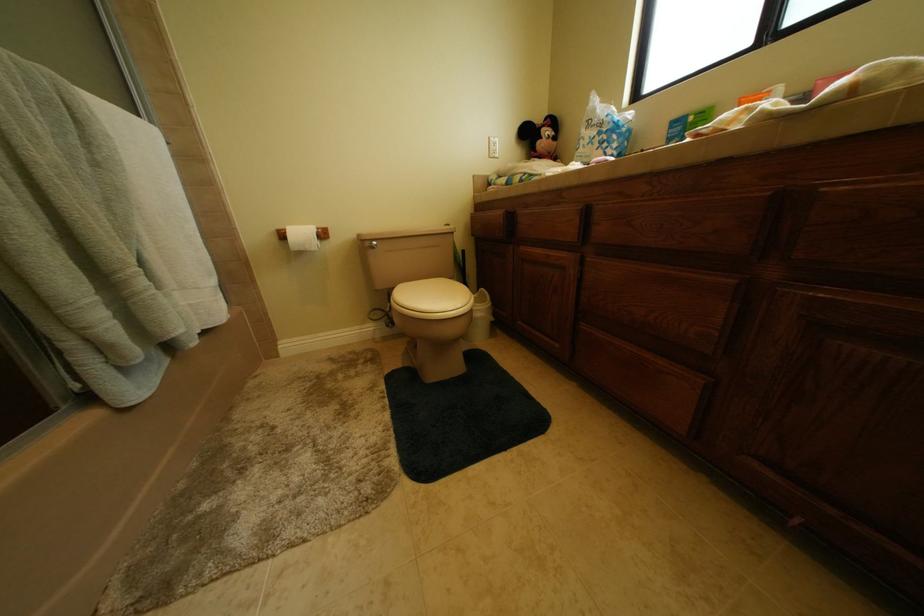
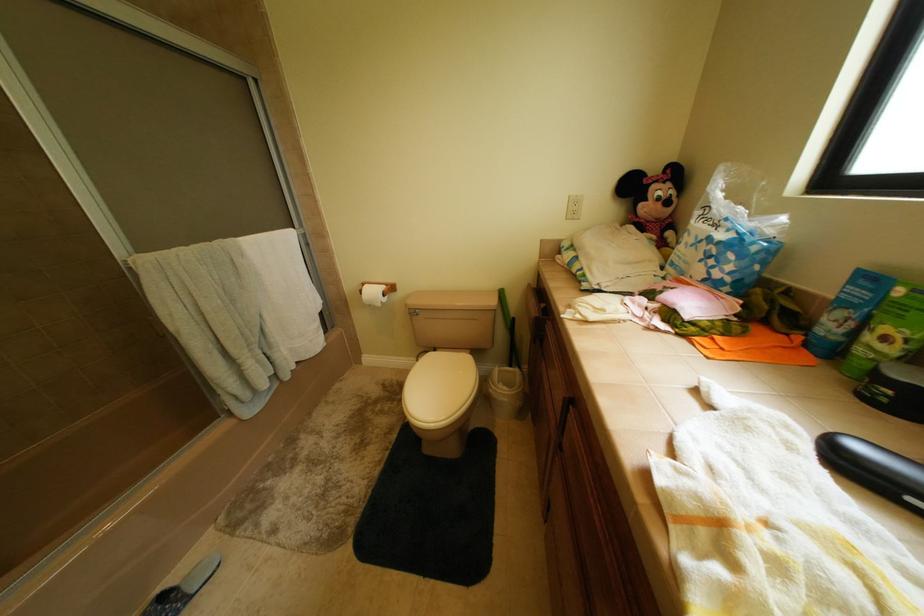
Question: The camera is either moving clockwise (left) or counter-clockwise (right) around the object. The first image is from the beginning of the video and the second image is from the end. Is the camera moving left or right when shooting the video?

Choices:
 (A) Left
 (B) Right

Answer: (B)